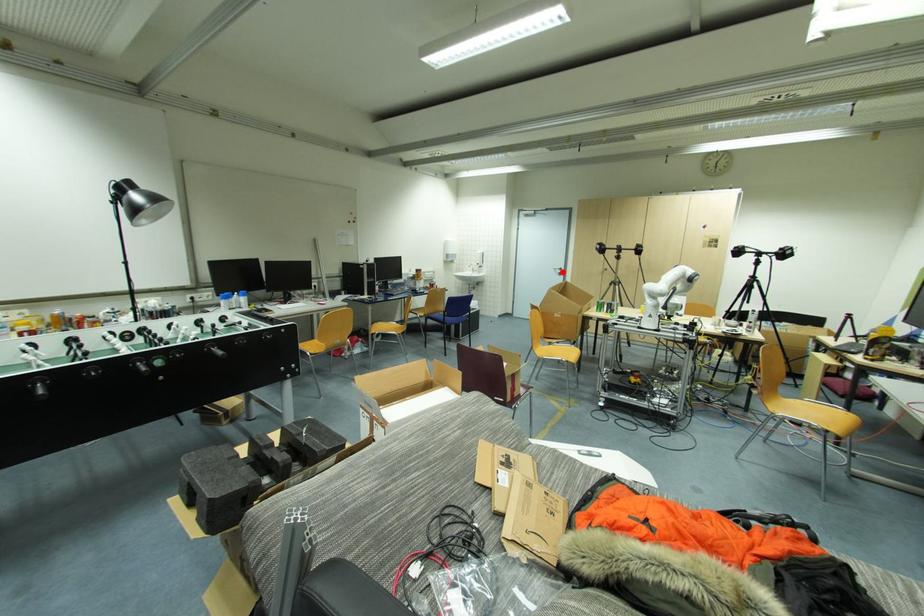
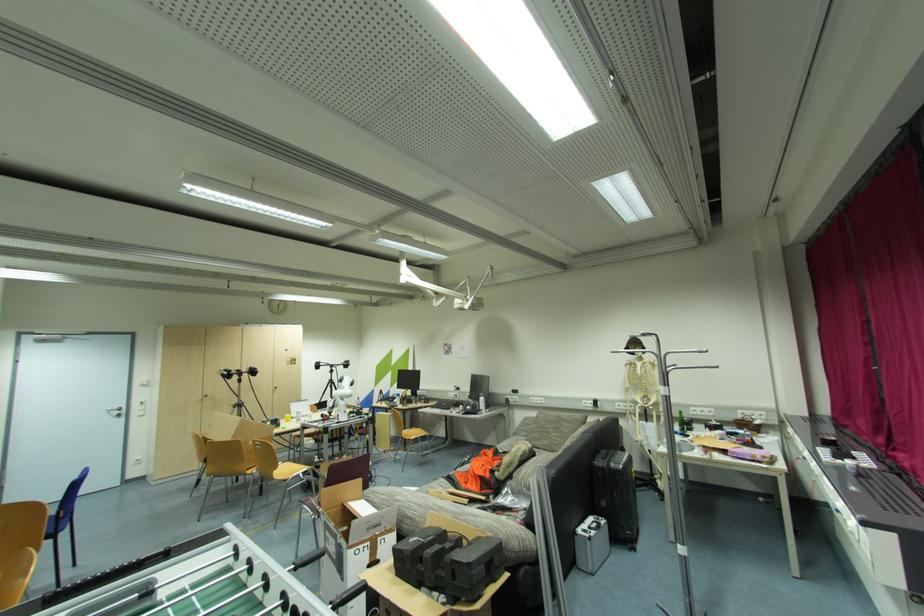
In the second image, find the point that corresponds to the highlighted location in the first image.

(122, 413)